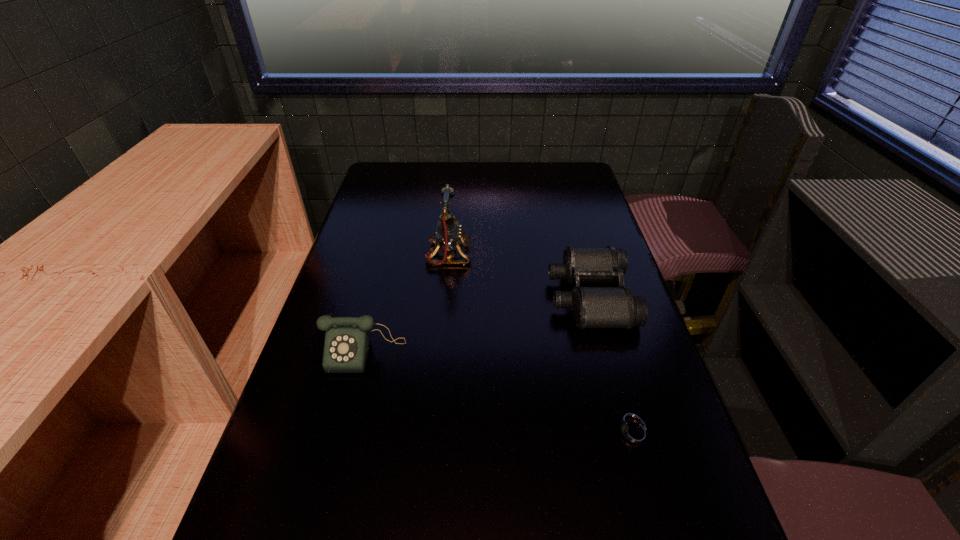
This screenshot has height=540, width=960. Find the location of `vacant space at the right edge of the desktop`. vacant space at the right edge of the desktop is located at coordinates (625, 353).

Where is `blank region between the binoculars and the right telephone`? This screenshot has width=960, height=540. blank region between the binoculars and the right telephone is located at coordinates (519, 276).

Locate an element on the screen. Image resolution: width=960 pixels, height=540 pixels. empty space between the shortest object and the binoculars is located at coordinates (612, 365).

Image resolution: width=960 pixels, height=540 pixels. I want to click on free space between the shorter telephone and the nearest object, so click(499, 392).

Find the location of a particular element. This screenshot has width=960, height=540. vacant point located between the shortest object and the taller telephone is located at coordinates (540, 344).

Locate an element on the screen. Image resolution: width=960 pixels, height=540 pixels. vacant area between the binoculars and the leftmost object is located at coordinates (477, 324).

Locate an element on the screen. Image resolution: width=960 pixels, height=540 pixels. free point between the farther telephone and the shortest object is located at coordinates (540, 344).

Where is `unoccupied area between the tallest object and the shorter telephone`? unoccupied area between the tallest object and the shorter telephone is located at coordinates (406, 303).

Find the location of a particular element. The width and height of the screenshot is (960, 540). free spot between the farther telephone and the watch is located at coordinates (540, 344).

Find the location of `free spot between the watch and the binoculars`. free spot between the watch and the binoculars is located at coordinates (612, 365).